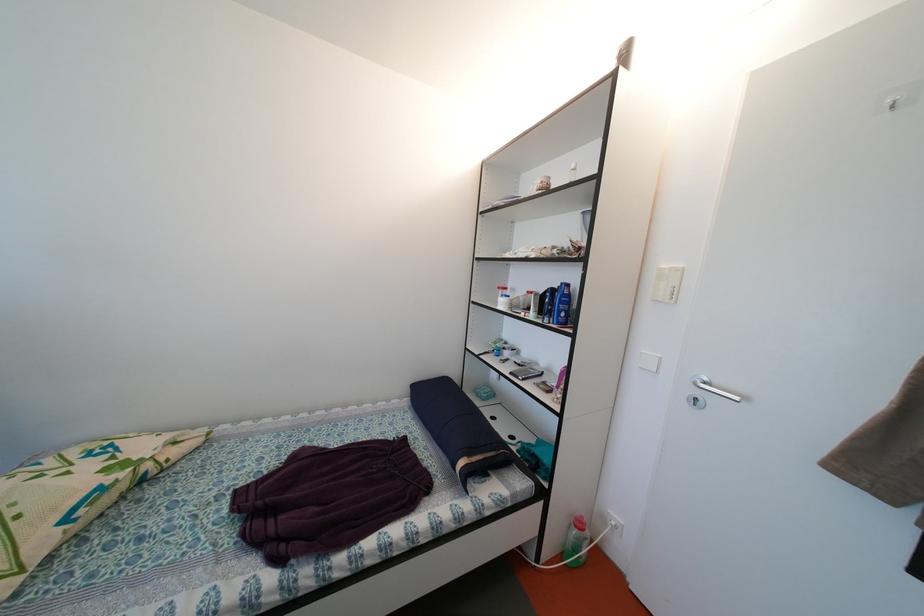
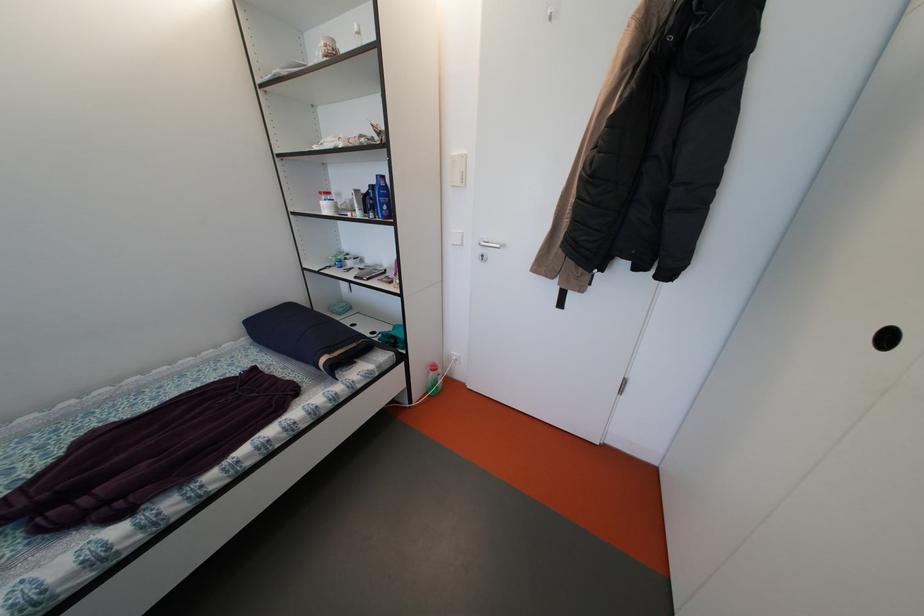
Find the pixel in the second image that matches [565,321] in the first image.

(390, 215)